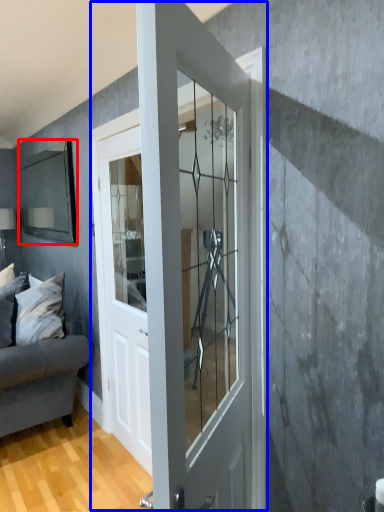
Question: Which point is closer to the camera, mirror (highlighted by a red box) or door (highlighted by a blue box)?

Choices:
 (A) mirror
 (B) door

Answer: (B)